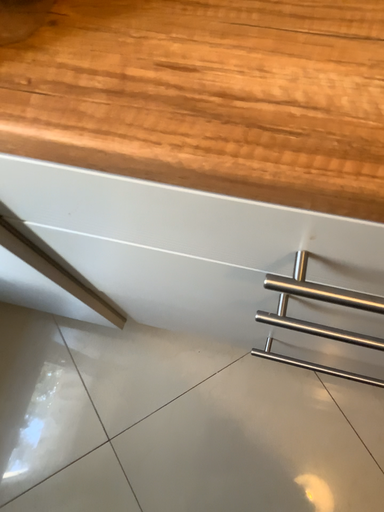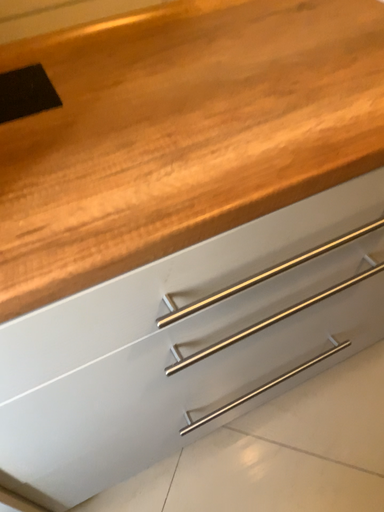
Question: How did the camera likely rotate when shooting the video?

Choices:
 (A) rotated upward
 (B) rotated downward

Answer: (A)